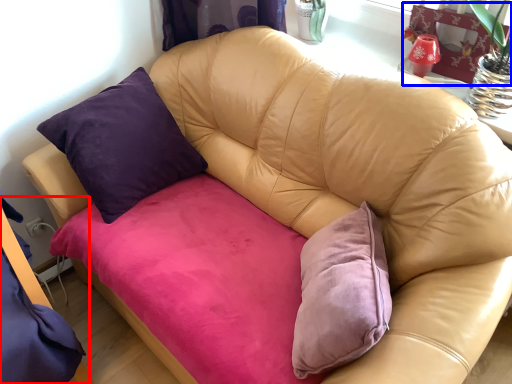
Question: Which point is further to the camera, bed frame (highlighted by a red box) or swivel chair (highlighted by a blue box)?

Choices:
 (A) bed frame
 (B) swivel chair

Answer: (B)